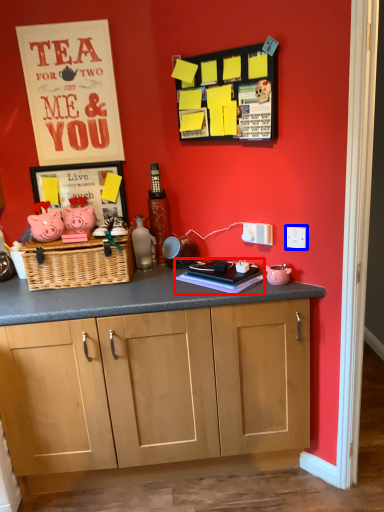
Question: Which point is further to the camera, book (highlighted by a red box) or electric outlet (highlighted by a blue box)?

Choices:
 (A) book
 (B) electric outlet

Answer: (A)